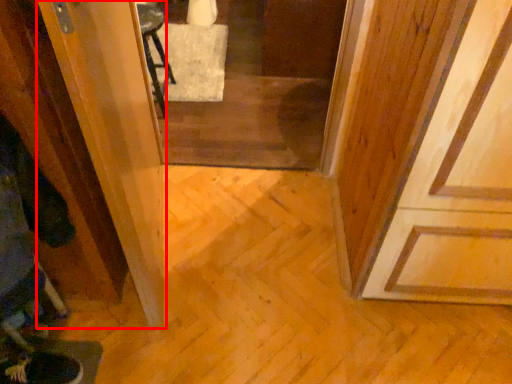
Question: Observing the image, what is the correct spatial positioning of screen door (annotated by the red box) in reference to screen door?

Choices:
 (A) left
 (B) right

Answer: (A)